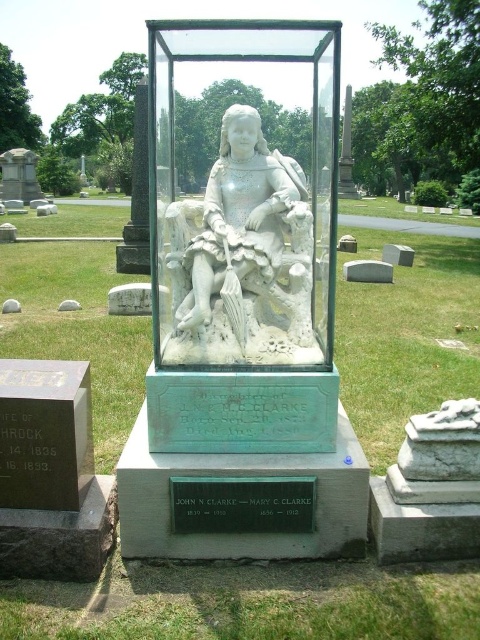
Question: Is transparent glass statue at center positioned behind white marble statue at center?

Choices:
 (A) yes
 (B) no

Answer: (B)

Question: Which object appears closest to the camera in this image?

Choices:
 (A) transparent glass statue at center
 (B) white marble statue at center
 (C) black metal plaque at center

Answer: (A)

Question: Which of these objects is positioned farthest from the transparent glass statue at center?

Choices:
 (A) white marble statue at center
 (B) black metal plaque at center

Answer: (B)

Question: Which object is the closest to the transparent glass statue at center?

Choices:
 (A) black metal plaque at center
 (B) white marble statue at center

Answer: (B)

Question: Is transparent glass statue at center positioned in front of black metal plaque at center?

Choices:
 (A) no
 (B) yes

Answer: (B)

Question: Can you confirm if transparent glass statue at center is wider than black metal plaque at center?

Choices:
 (A) no
 (B) yes

Answer: (B)